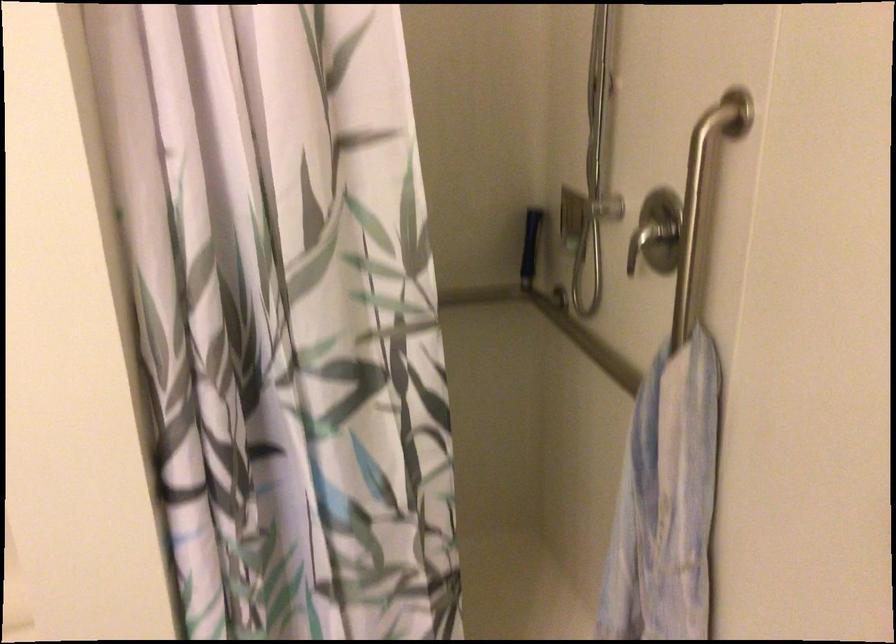
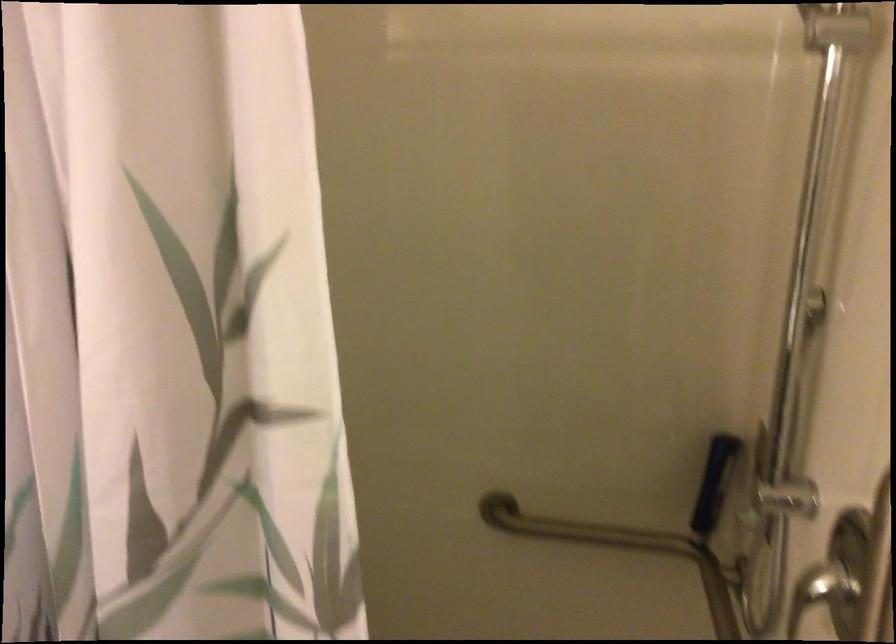
In the second image, find the point that corresponds to the point at 467,312 in the first image.

(622, 549)